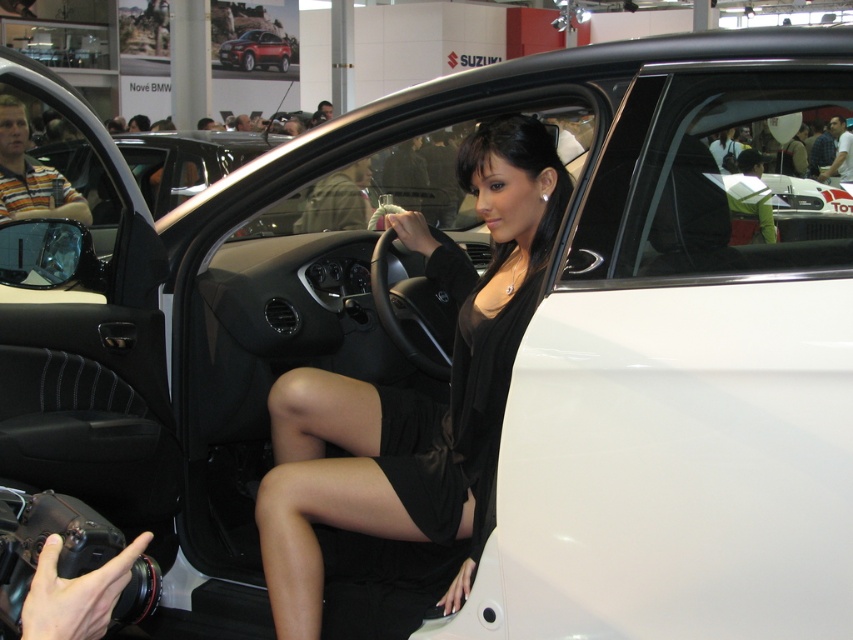
Which is below, black matte dress at center or black satin dress at center?

black satin dress at center is lower down.

Locate an element on the screen. Image resolution: width=853 pixels, height=640 pixels. black matte dress at center is located at coordinates (415, 392).

Does point (434, 452) come closer to viewer compared to point (421, 513)?

No, (434, 452) is behind (421, 513).

Where is `black matte dress at center`? black matte dress at center is located at coordinates (415, 392).

Is black matte dress at center below metallic red suv at upper center?

Correct, black matte dress at center is located below metallic red suv at upper center.

What do you see at coordinates (415, 392) in the screenshot? This screenshot has height=640, width=853. I see `black matte dress at center` at bounding box center [415, 392].

Is point (363, 502) farther from camera compared to point (265, 48)?

No, it is in front of (265, 48).

You are a GUI agent. You are given a task and a screenshot of the screen. Output one action in this format:
    pyautogui.click(x=<x>, y=<y>)
    Task: Click on the black matte dress at center
    This screenshot has width=853, height=640.
    Given the screenshot: What is the action you would take?
    pyautogui.click(x=415, y=392)

From the picture: Is black satin dress at center below metallic red suv at upper center?

Indeed, black satin dress at center is positioned under metallic red suv at upper center.

What do you see at coordinates (456, 420) in the screenshot? I see `black satin dress at center` at bounding box center [456, 420].

Where is `black satin dress at center`? Image resolution: width=853 pixels, height=640 pixels. black satin dress at center is located at coordinates (456, 420).